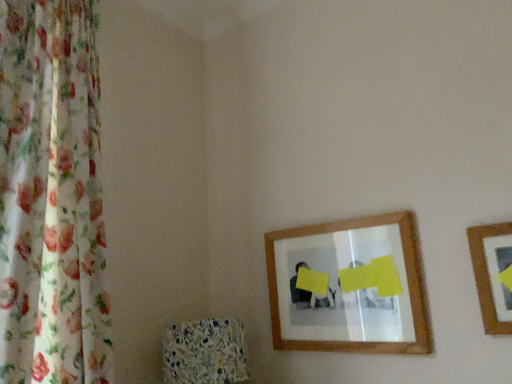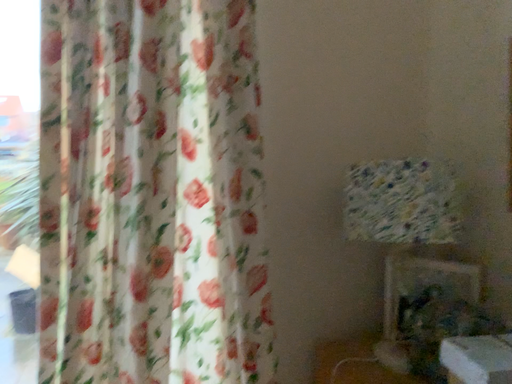
Question: How did the camera likely rotate when shooting the video?

Choices:
 (A) rotated left
 (B) rotated right

Answer: (A)